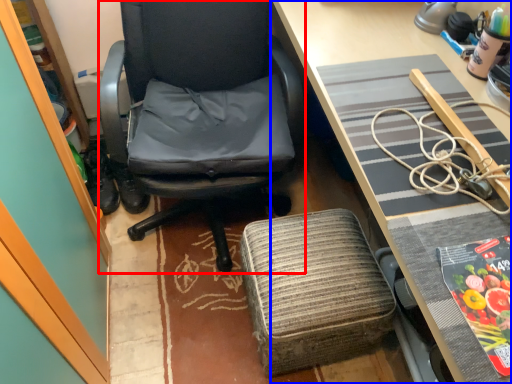
Question: Which object is further to the camera taking this photo, chair (highlighted by a red box) or desk (highlighted by a blue box)?

Choices:
 (A) chair
 (B) desk

Answer: (A)